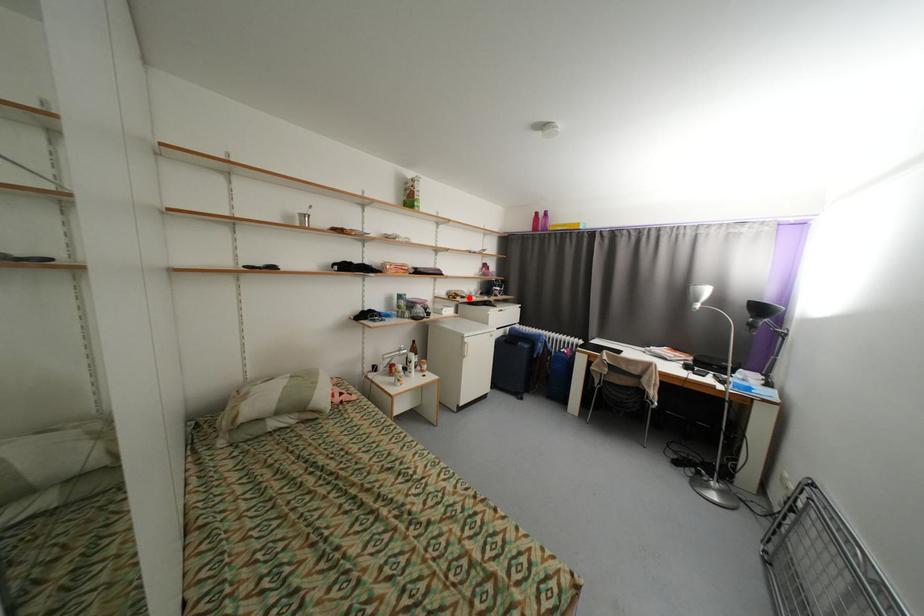
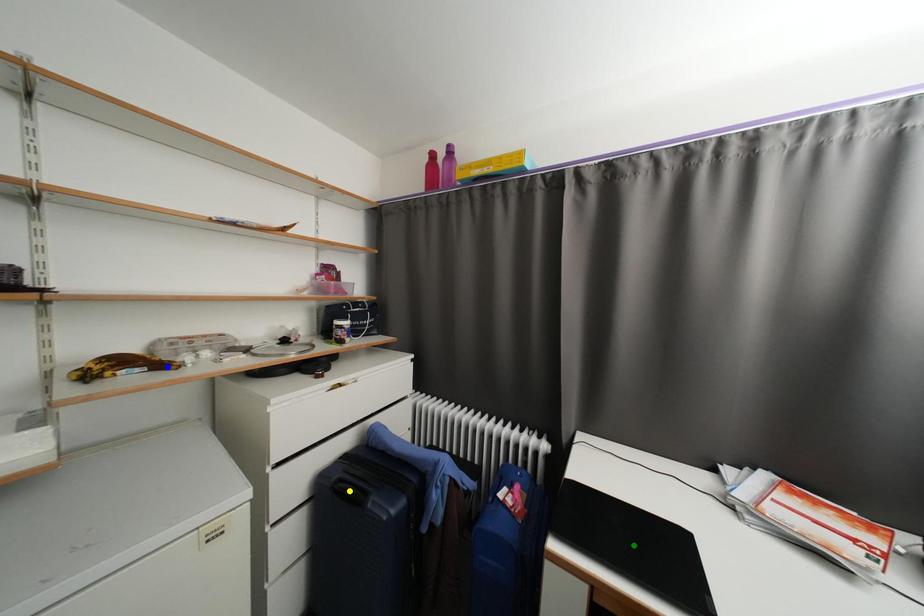
Question: I am providing you with two images of the same scene from different viewpoints. A red point is marked on the first image. You are given multiple points on the second image. Can you choose the point in image 2 that corresponds to the point in image 1?

Choices:
 (A) green point
 (B) yellow point
 (C) blue point

Answer: (C)